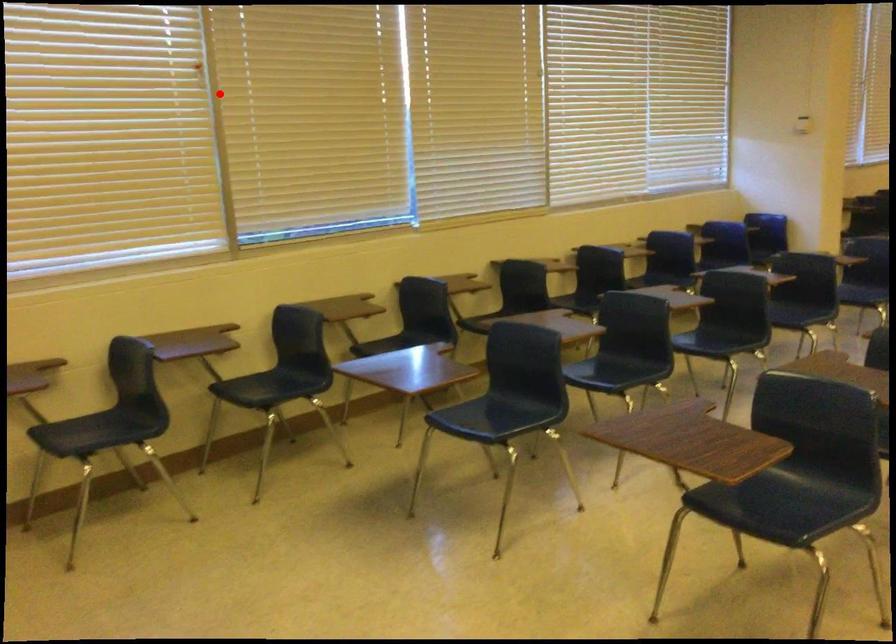
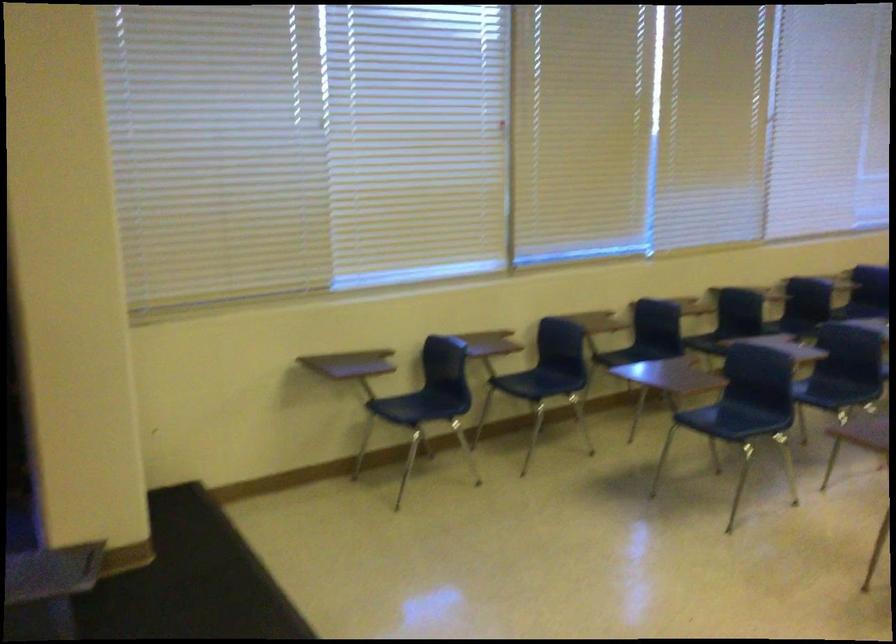
The point at the highlighted location is marked in the first image. Where is the corresponding point in the second image?

(510, 152)